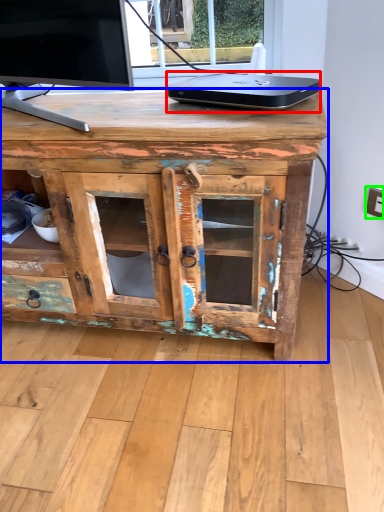
Question: Which object is positioned closest to laptop (highlighted by a red box)? Select from desk (highlighted by a blue box) and electric outlet (highlighted by a green box).

Choices:
 (A) desk
 (B) electric outlet

Answer: (A)